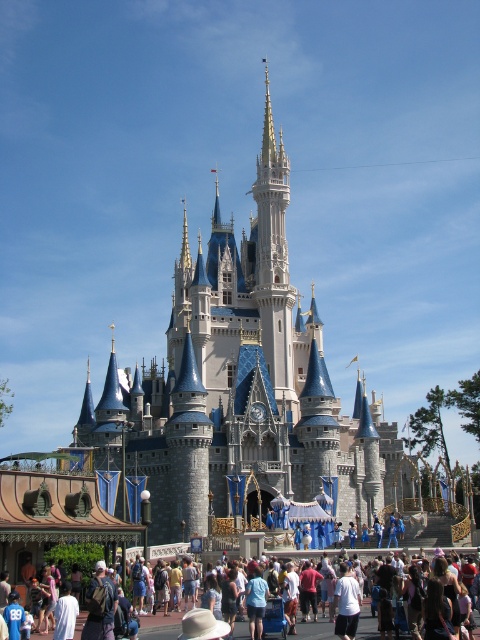
You are standing at the point marked as point (x=240, y=385) in the image. What structure are you directly facing?

The point (x=240, y=385) corresponds to the white stone castle at center, so you are directly facing the white stone castle at center.

You are a stage designer planning to set up a large banner between the white stone castle at center and the multicolored casual attire at center. Considering their sizes, which object should the banner be positioned closer to for better visual balance?

The white stone castle at center is larger in size than the multicolored casual attire at center, so the banner should be positioned closer to the multicolored casual attire at center to achieve better visual balance.